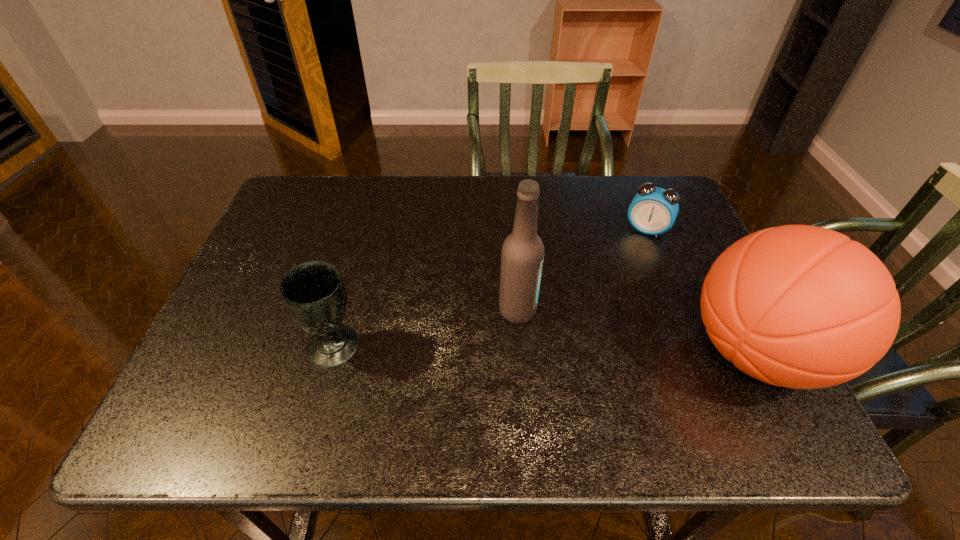
The height and width of the screenshot is (540, 960). Identify the location of chalice. (313, 292).

Identify the location of the second shortest object. This screenshot has width=960, height=540. (313, 292).

You are a GUI agent. You are given a task and a screenshot of the screen. Output one action in this format:
    pyautogui.click(x=<x>, y=<y>)
    Task: Click on the basketball
    The height and width of the screenshot is (540, 960).
    Given the screenshot: What is the action you would take?
    pyautogui.click(x=798, y=306)

The image size is (960, 540). What are the coordinates of `the farthest object` in the screenshot? It's located at (653, 211).

Where is `the shortest object`? The width and height of the screenshot is (960, 540). the shortest object is located at coordinates (653, 211).

The height and width of the screenshot is (540, 960). I want to click on beer bottle, so click(x=522, y=254).

Find the location of a particular element. This screenshot has height=540, width=960. vacant space positioned on the right of the chalice is located at coordinates (482, 346).

Identify the location of free space located 0.050m on the left of the basketball. The image size is (960, 540). (660, 352).

This screenshot has height=540, width=960. I want to click on free location located on the face of the shortest object, so click(x=634, y=253).

Locate an element on the screen. This screenshot has height=540, width=960. vacant area located 0.130m on the face of the shortest object is located at coordinates (626, 269).